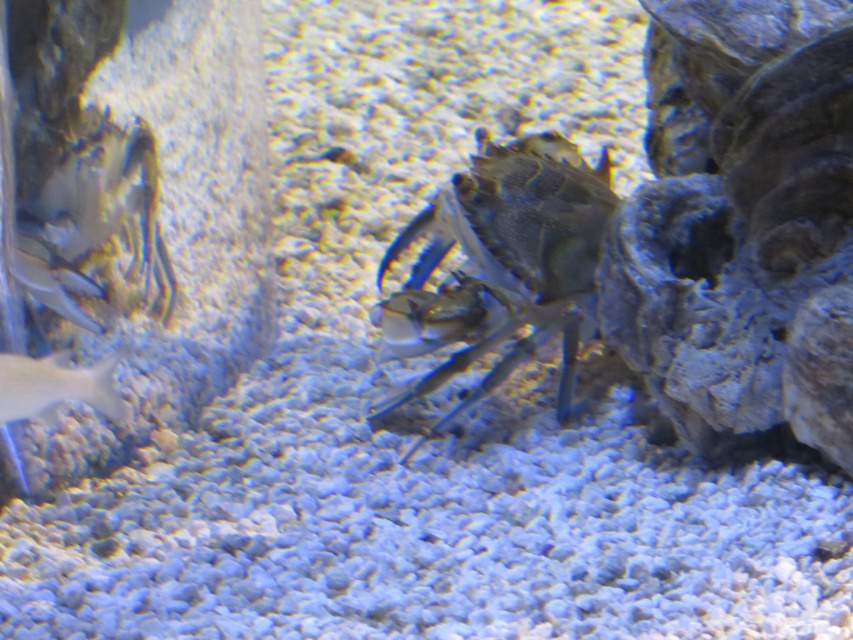
Question: Does shiny metallic crab at center appear under shiny silver fish at lower left?

Choices:
 (A) yes
 (B) no

Answer: (B)

Question: Where is shiny metallic crab at center located in relation to shiny silver fish at lower left in the image?

Choices:
 (A) above
 (B) below

Answer: (A)

Question: Which of the following is the closest to the observer?

Choices:
 (A) click(398, 342)
 (B) click(57, 360)

Answer: (B)

Question: From the image, what is the correct spatial relationship of shiny metallic crab at center in relation to shiny silver fish at lower left?

Choices:
 (A) right
 (B) left

Answer: (A)

Question: Which point is farther from the camera taking this photo?

Choices:
 (A) (509, 240)
 (B) (59, 400)

Answer: (A)

Question: Which of the following is the closest to the observer?

Choices:
 (A) shiny metallic crab at center
 (B) shiny silver fish at lower left

Answer: (B)